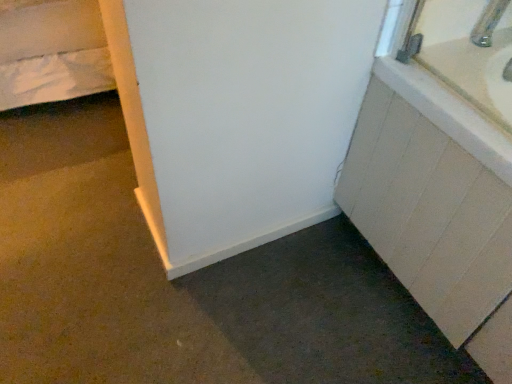
Question: Is metallic silver faucet at upper right to the left or to the right of white matte cabinet at right in the image?

Choices:
 (A) left
 (B) right

Answer: (A)

Question: Is metallic silver faucet at upper right spatially inside white matte cabinet at right, or outside of it?

Choices:
 (A) outside
 (B) inside

Answer: (A)

Question: From a real-world perspective, relative to white matte cabinet at right, is metallic silver faucet at upper right vertically above or below?

Choices:
 (A) below
 (B) above

Answer: (B)

Question: Based on their positions, is white matte cabinet at right located to the left or right of metallic silver faucet at upper right?

Choices:
 (A) right
 (B) left

Answer: (A)

Question: From the image's perspective, is white matte cabinet at right located above or below metallic silver faucet at upper right?

Choices:
 (A) above
 (B) below

Answer: (B)

Question: In terms of width, does white matte cabinet at right look wider or thinner when compared to metallic silver faucet at upper right?

Choices:
 (A) thin
 (B) wide

Answer: (B)

Question: Considering their positions, is white matte cabinet at right located in front of or behind metallic silver faucet at upper right?

Choices:
 (A) front
 (B) behind

Answer: (A)